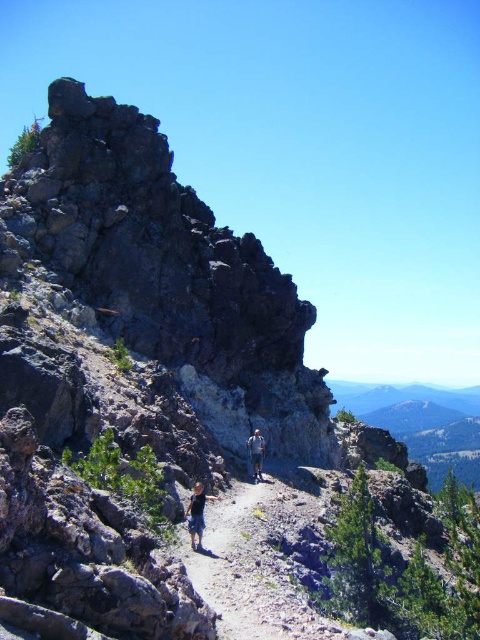
You are a drone operator planning to capture aerial footage of the mountain trail. The drone has a maximum flight range of 100 feet. There is a specific point marked at coordinates point (193, 531) that you need to film. Based on the scene, can your drone safely reach that point without exceeding its range?

The distance between point (193, 531) and the camera is 98.98 feet, which is within the drone s 100 feet maximum range. Therefore, the drone can safely reach the point without exceeding its range.

You are a hiker trying to locate your friend who is wearing dark blue shorts at center on a rugged mountain trail. According to the map, the coordinates of the trailhead are at point 0.000, 0.000. What direction should you head to find your friend?

The dark blue shorts at center is located at point (196, 513), so you should head northeast to find your friend.

You are a photographer standing on the rocky path and want to capture both the dark blue shorts at center and the blue denim shorts at center in a single frame. Which hiker should you position closer to the left side of your camera viewfinder to include both in the shot?

To include both the dark blue shorts at center and the blue denim shorts at center in the shot, you should position the dark blue shorts at center closer to the left side of your camera viewfinder since it is already on the left side of the blue denim shorts at center.